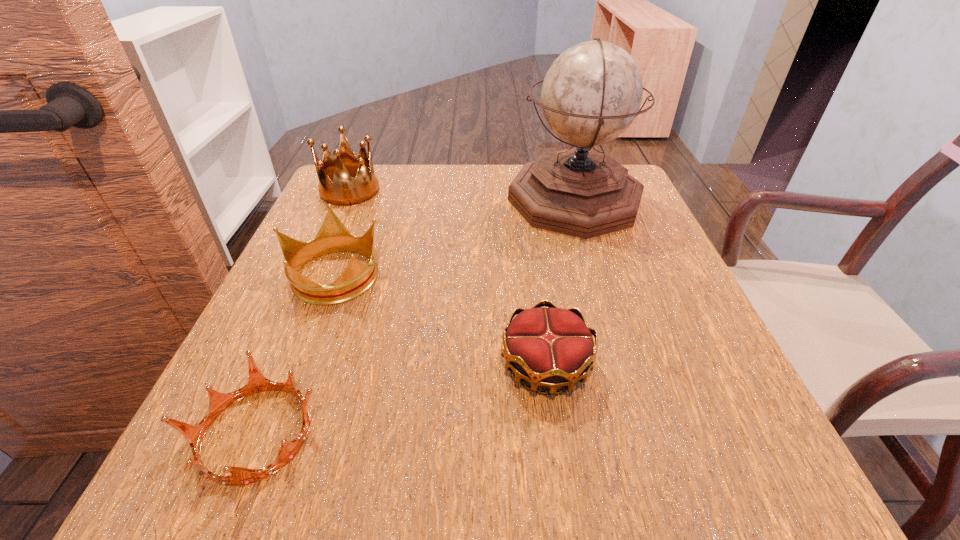
Locate an element on the screen. This screenshot has height=540, width=960. vacant space at the near edge is located at coordinates (439, 503).

Where is `blank space at the left edge of the desktop`? The image size is (960, 540). blank space at the left edge of the desktop is located at coordinates (231, 368).

At what (x,y) coordinates should I click in order to perform the action: click on free space at the right edge. Please return your answer as a coordinate pair (x, y). Image resolution: width=960 pixels, height=540 pixels. Looking at the image, I should click on (636, 238).

Where is `vacant area at the near left corner of the desktop`? vacant area at the near left corner of the desktop is located at coordinates (185, 449).

Where is `free spot between the rightmost crown and the farthest crown`? The height and width of the screenshot is (540, 960). free spot between the rightmost crown and the farthest crown is located at coordinates (447, 278).

The height and width of the screenshot is (540, 960). What are the coordinates of `vacant area between the tallest crown and the rightmost crown` in the screenshot? It's located at (447, 278).

At what (x,y) coordinates should I click in order to perform the action: click on free space between the globe and the third farthest object. Please return your answer as a coordinate pair (x, y). The height and width of the screenshot is (540, 960). Looking at the image, I should click on (454, 237).

The width and height of the screenshot is (960, 540). Identify the location of unoccupied position between the tallest object and the rightmost crown. (560, 282).

The image size is (960, 540). Find the location of `free area in between the second tallest object and the rightmost crown`. free area in between the second tallest object and the rightmost crown is located at coordinates (447, 278).

Locate an element on the screen. This screenshot has width=960, height=540. object that stands as the third closest to the rightmost crown is located at coordinates (591, 94).